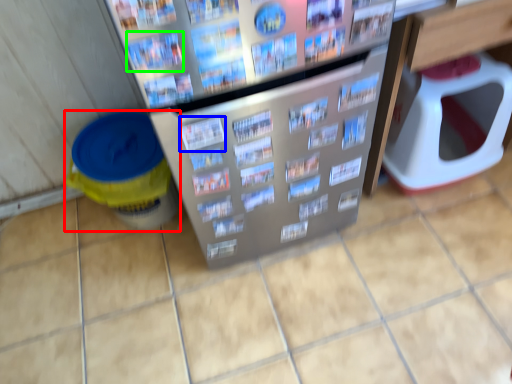
Question: Which object is the closest to the recycling bin (highlighted by a red box)? Choose among these: magazine (highlighted by a blue box) or magazine (highlighted by a green box).

Choices:
 (A) magazine
 (B) magazine

Answer: (A)